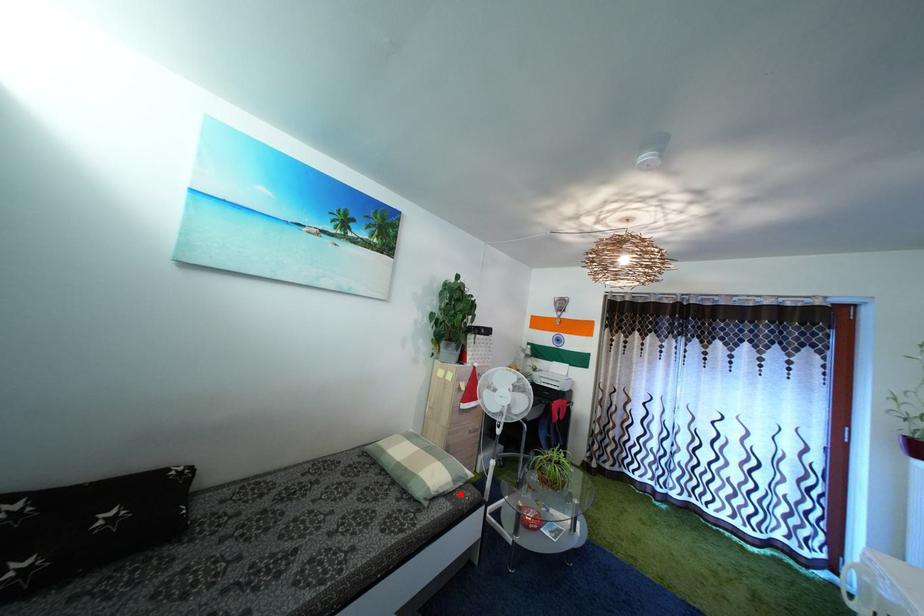
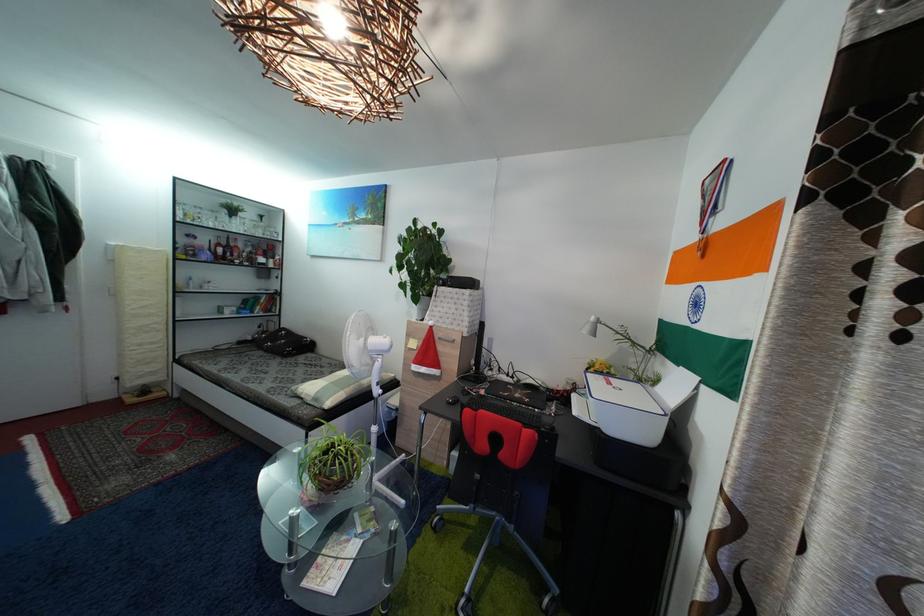
The point at the highlighted location is marked in the first image. Where is the corresponding point in the second image?

(318, 407)